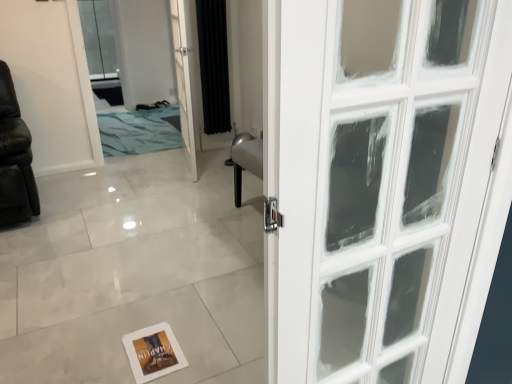
Find the location of `vacant area located to the right-hand side of white glass door at center`. vacant area located to the right-hand side of white glass door at center is located at coordinates (214, 167).